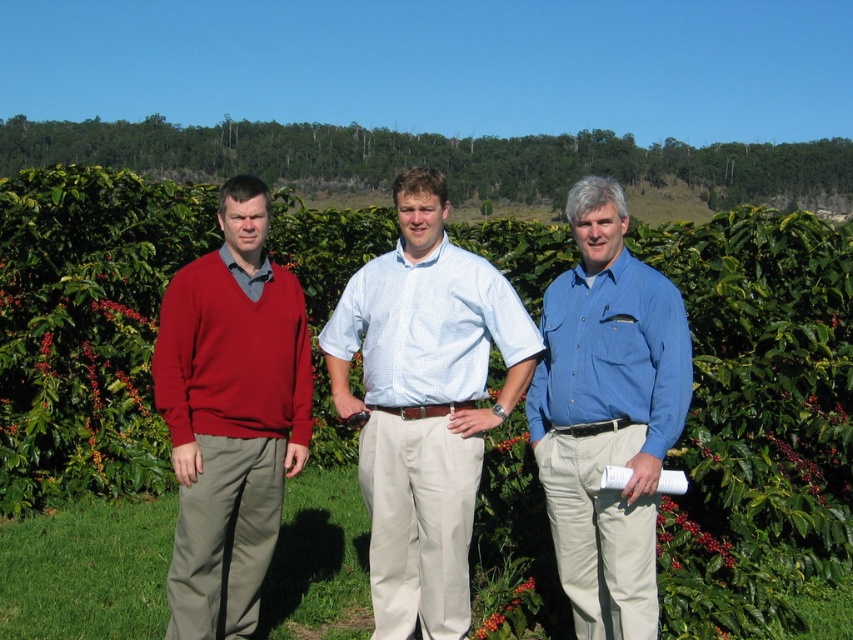
Question: Which point is closer to the camera?

Choices:
 (A) (555, 492)
 (B) (531, 365)
 (C) (241, 310)

Answer: (A)

Question: Is green leafy vines at center to the left of blue cotton shirt at center from the viewer's perspective?

Choices:
 (A) yes
 (B) no

Answer: (A)

Question: Is the position of green leafy vines at center less distant than that of matte red sweater at left?

Choices:
 (A) no
 (B) yes

Answer: (B)

Question: Among these objects, which one is farthest from the camera?

Choices:
 (A) green leafy vines at center
 (B) light blue checkered shirt at center
 (C) matte red sweater at left

Answer: (B)

Question: From the image, what is the correct spatial relationship of matte red sweater at left in relation to blue cotton shirt at center?

Choices:
 (A) left
 (B) right

Answer: (A)

Question: Estimate the real-world distances between objects in this image. Which object is closer to the matte red sweater at left?

Choices:
 (A) green leafy vines at center
 (B) blue cotton shirt at center

Answer: (B)